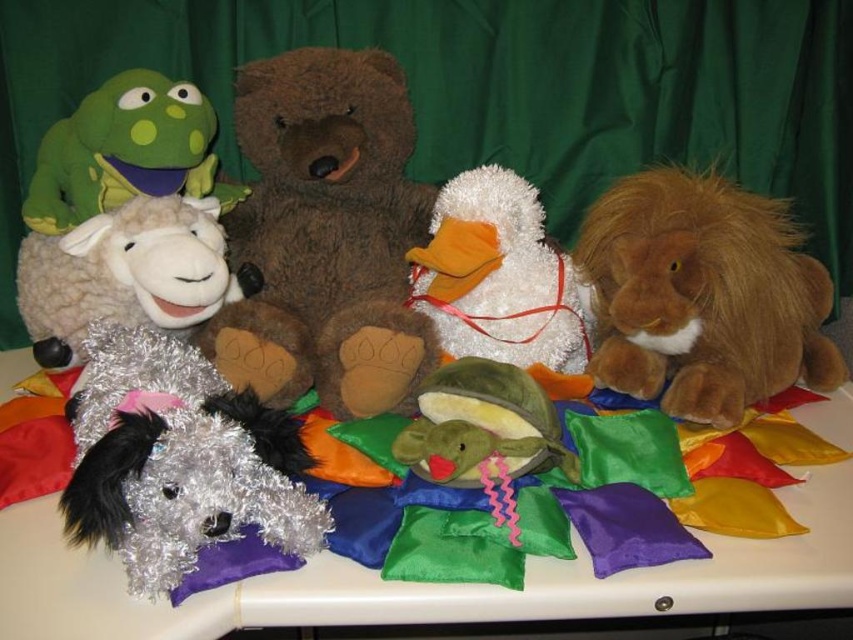
Who is more distant from viewer, (x=315, y=218) or (x=500, y=253)?

Point (x=315, y=218)

This screenshot has width=853, height=640. What are the coordinates of `brown plush bear at center` in the screenshot? It's located at (326, 236).

This screenshot has width=853, height=640. Describe the element at coordinates (326, 236) in the screenshot. I see `brown plush bear at center` at that location.

Is point (276, 362) more distant than point (704, 563)?

Yes, it is.

This screenshot has height=640, width=853. Find the location of `brown plush bear at center`. brown plush bear at center is located at coordinates (326, 236).

In the scene shown: Does brown plush lion at right have a greater height compared to white fluffy duck at center?

Indeed, brown plush lion at right has a greater height compared to white fluffy duck at center.

Is point (763, 333) positioned after point (425, 269)?

No, it is in front of (425, 269).

The width and height of the screenshot is (853, 640). I want to click on brown plush lion at right, so click(x=703, y=296).